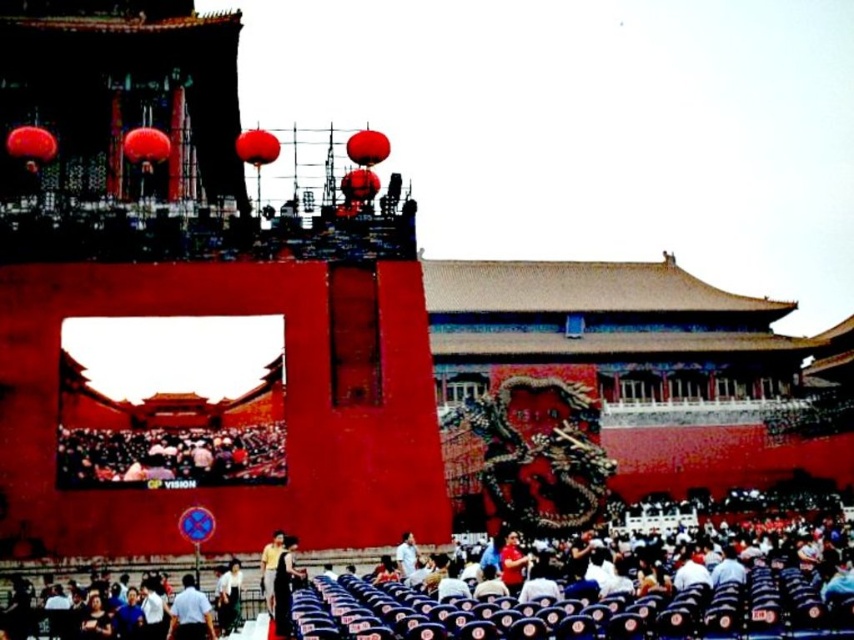
Does dark gray fabric crowd at lower left have a greater width compared to dark blue shirt at lower center?

Indeed, dark gray fabric crowd at lower left has a greater width compared to dark blue shirt at lower center.

Is point (190, 480) in front of point (183, 596)?

No, it is behind (183, 596).

The image size is (854, 640). I want to click on dark gray fabric crowd at lower left, so click(x=170, y=456).

Is black fabric person at lower center positioned before yellow shirt at lower center?

Yes, it is.

Locate an element on the screen. This screenshot has width=854, height=640. black fabric person at lower center is located at coordinates [285, 588].

Is dark gray fabric crowd at lower left above black fabric person at lower center?

Correct, dark gray fabric crowd at lower left is located above black fabric person at lower center.

Can you confirm if dark gray fabric crowd at lower left is shorter than black fabric person at lower center?

No.

Locate an element on the screen. dark gray fabric crowd at lower left is located at coordinates (170, 456).